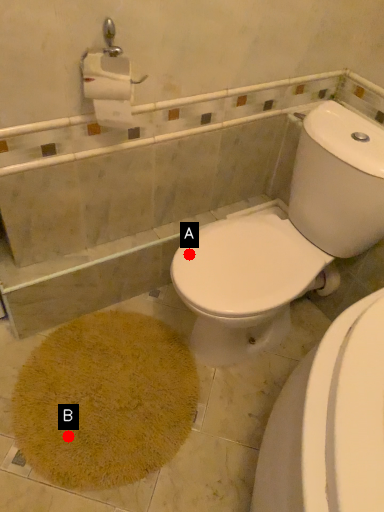
Question: Two points are circled on the image, labeled by A and B beside each circle. Among these points, which one is nearest to the camera?

Choices:
 (A) A is closer
 (B) B is closer

Answer: (A)